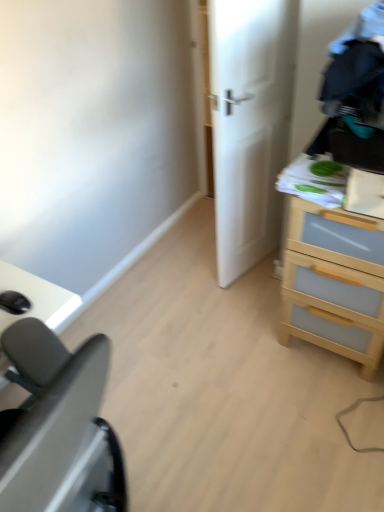
Where is `vacant space that is to the left of white matte door at center`? The image size is (384, 512). vacant space that is to the left of white matte door at center is located at coordinates (184, 278).